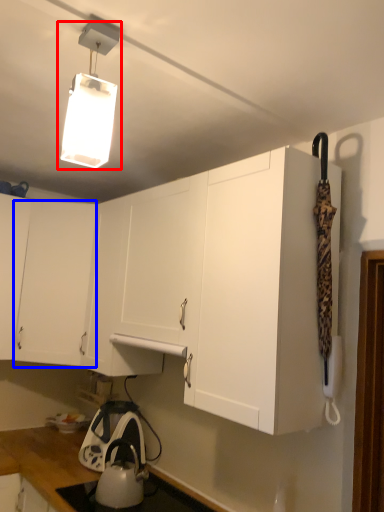
Question: Which object appears farthest to the camera in this image, lamp (highlighted by a red box) or cabinetry (highlighted by a blue box)?

Choices:
 (A) lamp
 (B) cabinetry

Answer: (B)